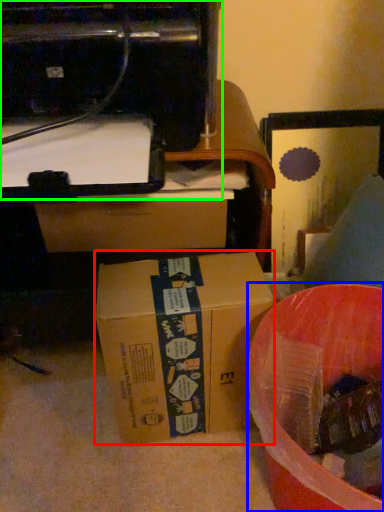
Question: Which object is the closest to the box (highlighted by a red box)? Choose among these: waste (highlighted by a blue box) or printer (highlighted by a green box).

Choices:
 (A) waste
 (B) printer

Answer: (A)